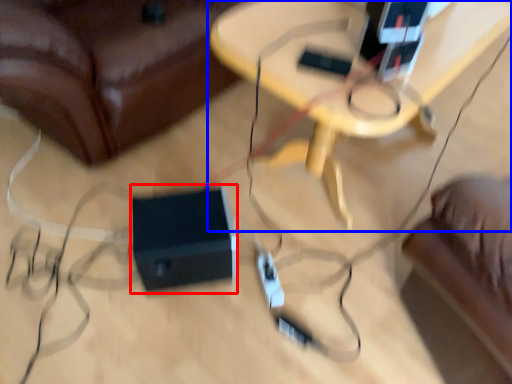
Question: Which of the following is the closest to the observer, speaker (highlighted by a red box) or table (highlighted by a blue box)?

Choices:
 (A) speaker
 (B) table

Answer: (B)